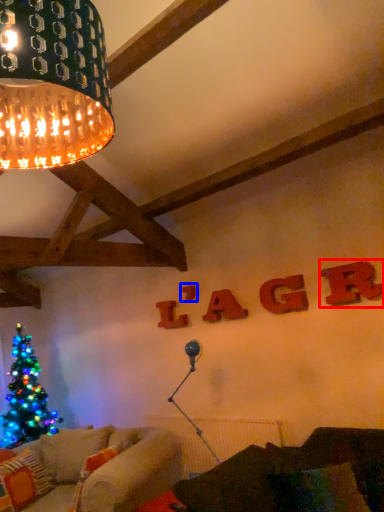
Question: Among these objects, which one is farthest to the camera, letter (highlighted by a red box) or letter (highlighted by a blue box)?

Choices:
 (A) letter
 (B) letter

Answer: (B)